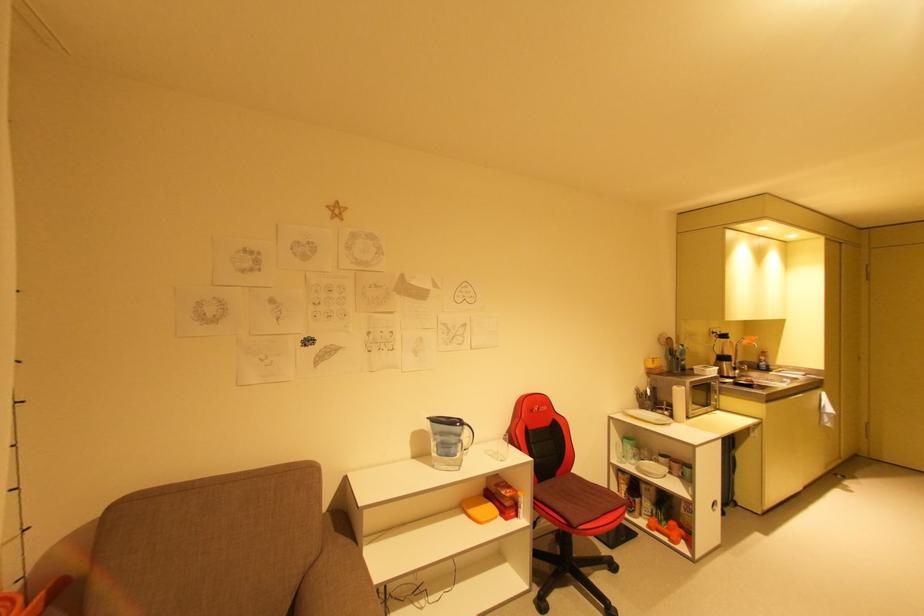
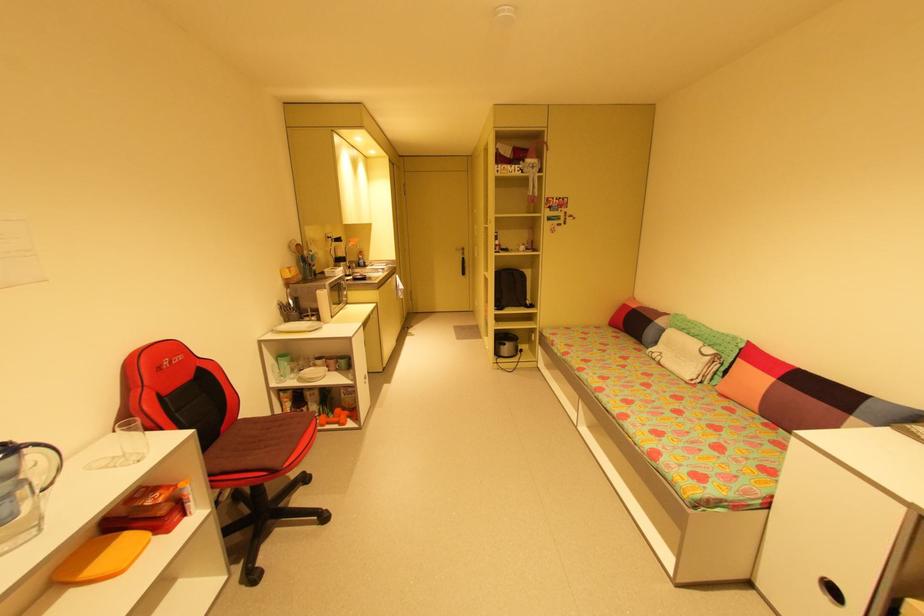
Find the pixel in the second image that matches (x=675, y=538) in the first image.

(345, 422)